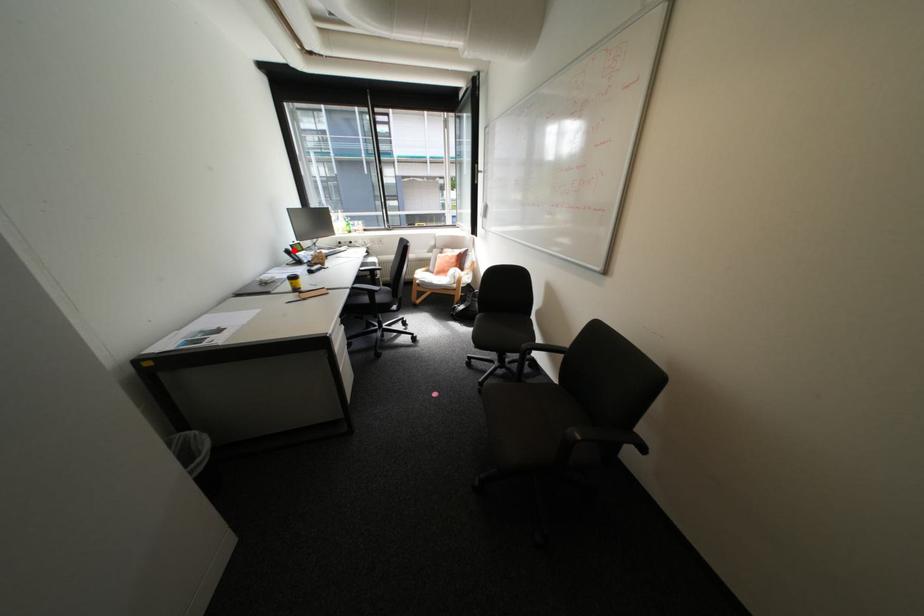
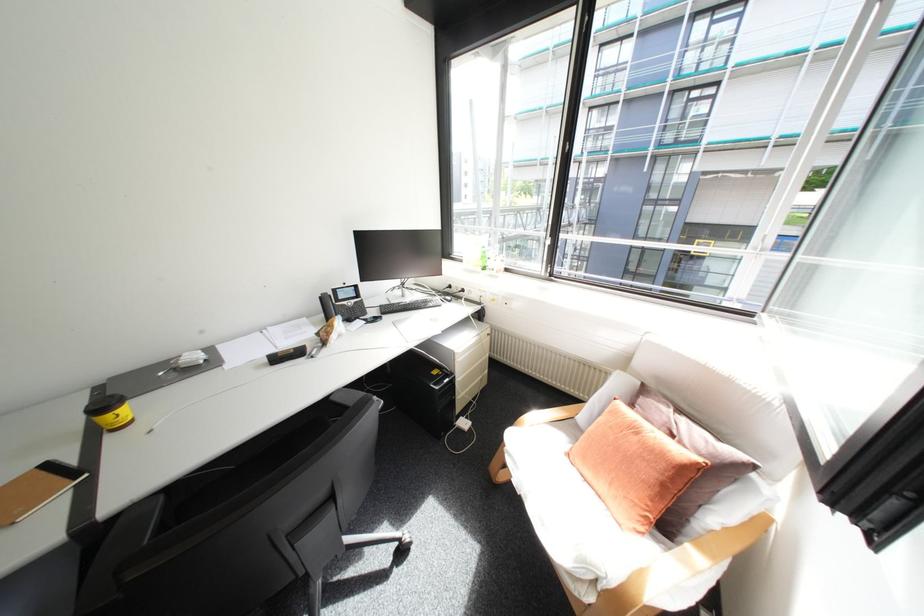
The point at the highlighted location is marked in the first image. Where is the corresponding point in the second image?

(330, 296)